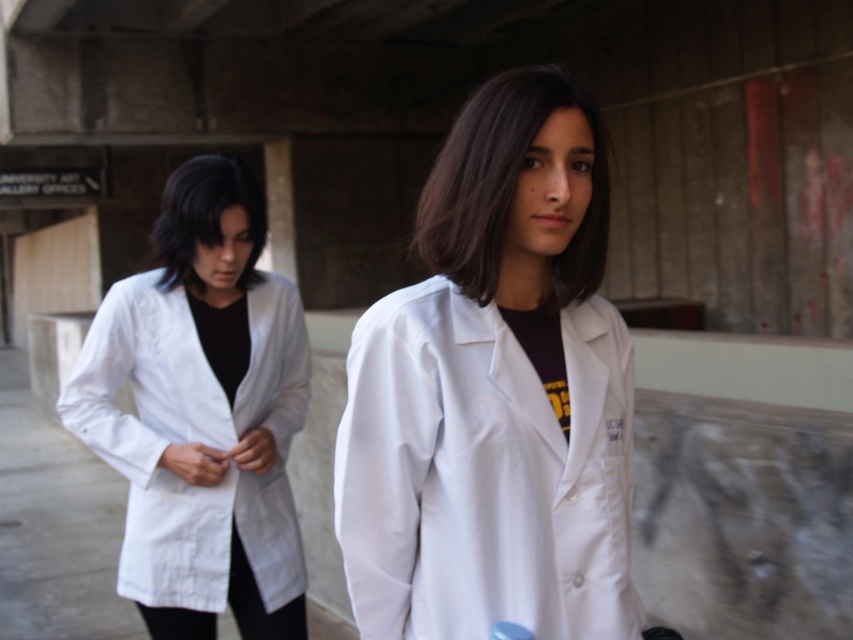
Can you confirm if white matte lab coat at center is positioned below white cotton lab coat at left?

No, white matte lab coat at center is not below white cotton lab coat at left.

From the picture: Does white matte lab coat at center have a smaller size compared to white cotton lab coat at left?

Yes, white matte lab coat at center is smaller than white cotton lab coat at left.

Image resolution: width=853 pixels, height=640 pixels. In order to click on white matte lab coat at center in this screenshot , I will do `click(495, 392)`.

Does white matte lab coat at center appear on the right side of smooth black hair at left?

Correct, you'll find white matte lab coat at center to the right of smooth black hair at left.

Does white matte lab coat at center appear over smooth black hair at left?

Incorrect, white matte lab coat at center is not positioned above smooth black hair at left.

Which is behind, point (360, 420) or point (219, 186)?

Point (219, 186)

The width and height of the screenshot is (853, 640). Identify the location of white matte lab coat at center. (495, 392).

Which is below, white cotton lab coat at left or smooth black hair at left?

Positioned lower is white cotton lab coat at left.

You are a GUI agent. You are given a task and a screenshot of the screen. Output one action in this format:
    pyautogui.click(x=<x>, y=<y>)
    Task: Click on the white cotton lab coat at left
    
    Given the screenshot: What is the action you would take?
    pyautogui.click(x=193, y=440)